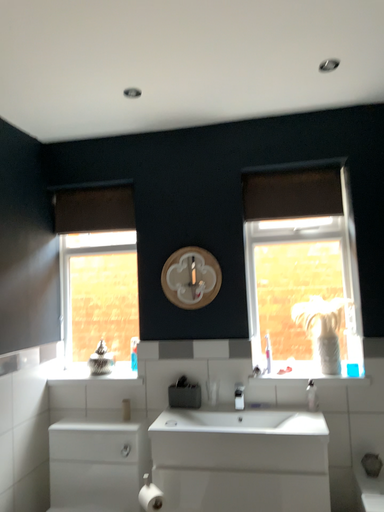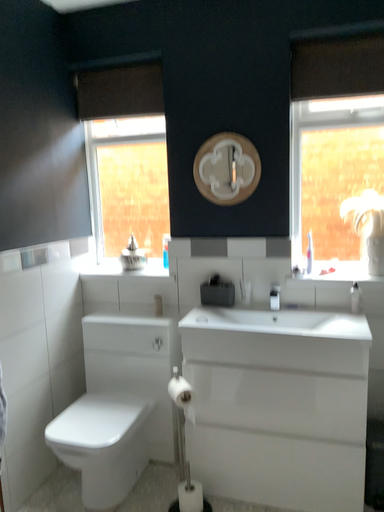
Question: Which way did the camera rotate in the video?

Choices:
 (A) rotated upward
 (B) rotated downward

Answer: (B)